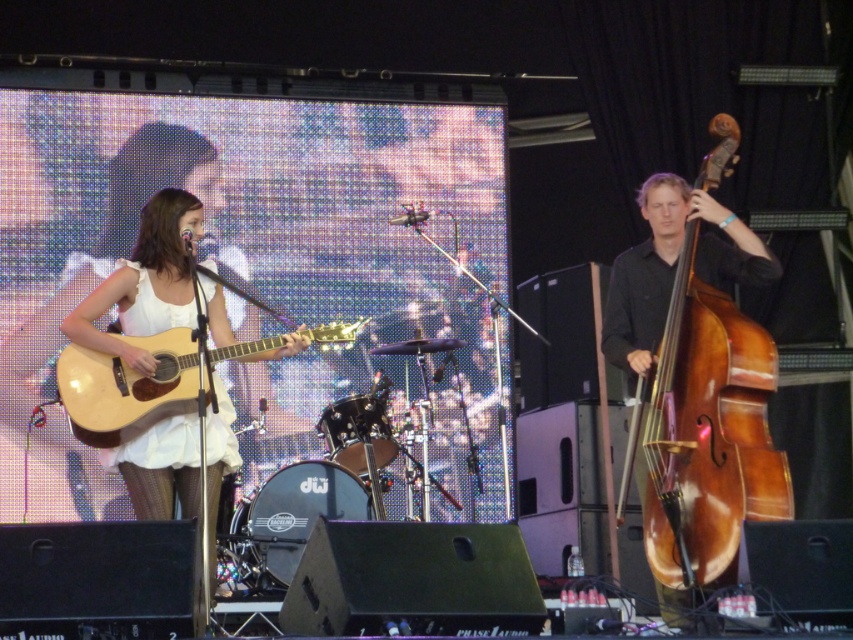
Is brown wooden cello at right to the right of light brown wood acoustic guitar at center-left from the viewer's perspective?

Yes, brown wooden cello at right is to the right of light brown wood acoustic guitar at center-left.

The image size is (853, 640). What do you see at coordinates (711, 429) in the screenshot? I see `brown wooden cello at right` at bounding box center [711, 429].

Is point (700, 401) closer to viewer compared to point (154, 403)?

Yes.

Where is `brown wooden cello at right`? This screenshot has width=853, height=640. brown wooden cello at right is located at coordinates (711, 429).

Is brown wooden cello at right above matte white dress at center?

No, brown wooden cello at right is not above matte white dress at center.

Between point (728, 552) and point (138, 289), which one is positioned in front?

Point (728, 552)

The width and height of the screenshot is (853, 640). Identify the location of brown wooden cello at right. (711, 429).

Based on the photo, can you confirm if matte white dress at center is thinner than light brown wood acoustic guitar at center-left?

Indeed, matte white dress at center has a lesser width compared to light brown wood acoustic guitar at center-left.

Who is lower down, matte white dress at center or light brown wood acoustic guitar at center-left?

matte white dress at center is lower down.

Find the location of `matte white dress at center`. matte white dress at center is located at coordinates (154, 285).